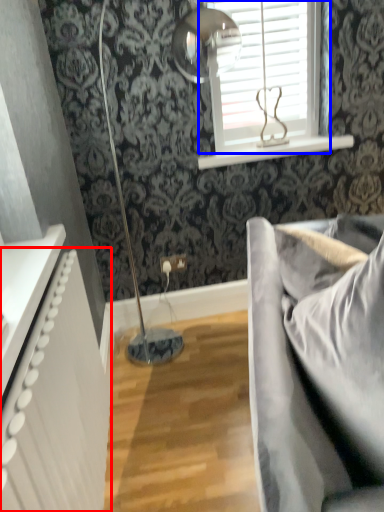
Question: Which of the following is the farthest to the observer, radiator (highlighted by a red box) or window (highlighted by a blue box)?

Choices:
 (A) radiator
 (B) window

Answer: (B)